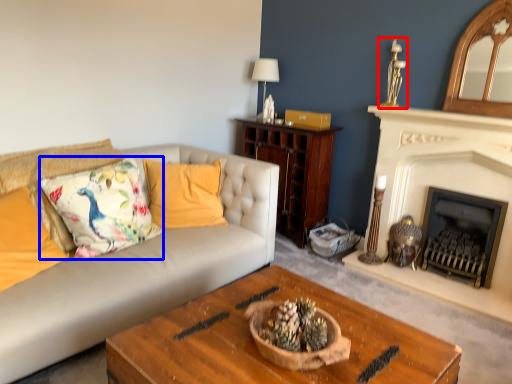
Question: Among these objects, which one is farthest to the camera, candle holder (highlighted by a red box) or throw pillow (highlighted by a blue box)?

Choices:
 (A) candle holder
 (B) throw pillow

Answer: (A)